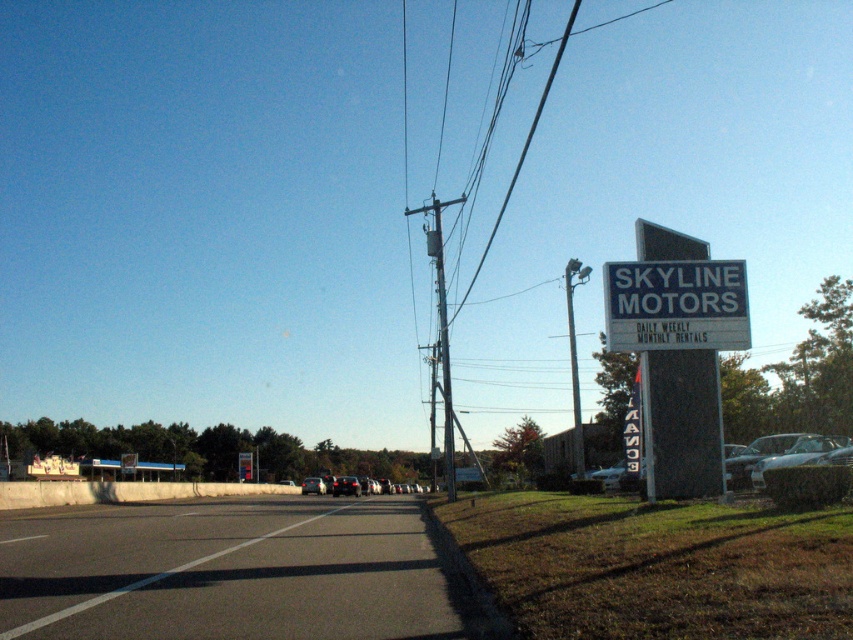
Is shiny silver sedan at center above matte black car at center?

Incorrect, shiny silver sedan at center is not positioned above matte black car at center.

Who is more distant from viewer, (358, 492) or (310, 492)?

Point (310, 492)

Locate an element on the screen. shiny silver sedan at center is located at coordinates [346, 486].

Where is `metallic gray utility pole at center`? The image size is (853, 640). metallic gray utility pole at center is located at coordinates (442, 336).

Measure the distance from metallic gray utility pole at center to metallic gray pole at upper right.

metallic gray utility pole at center and metallic gray pole at upper right are 57.49 feet apart from each other.

Image resolution: width=853 pixels, height=640 pixels. In order to click on metallic gray utility pole at center in this screenshot , I will do `click(442, 336)`.

Find the location of `metallic gray utility pole at center`. metallic gray utility pole at center is located at coordinates (442, 336).

Who is more forward, [648,333] or [363,477]?

Positioned in front is point [648,333].

Looking at this image, is white plastic sign at upper right taller than silver metallic car at center?

In fact, white plastic sign at upper right may be shorter than silver metallic car at center.

Is point (648, 300) farther from viewer compared to point (378, 483)?

No, it is in front of (378, 483).

This screenshot has width=853, height=640. I want to click on white plastic sign at upper right, so click(x=676, y=305).